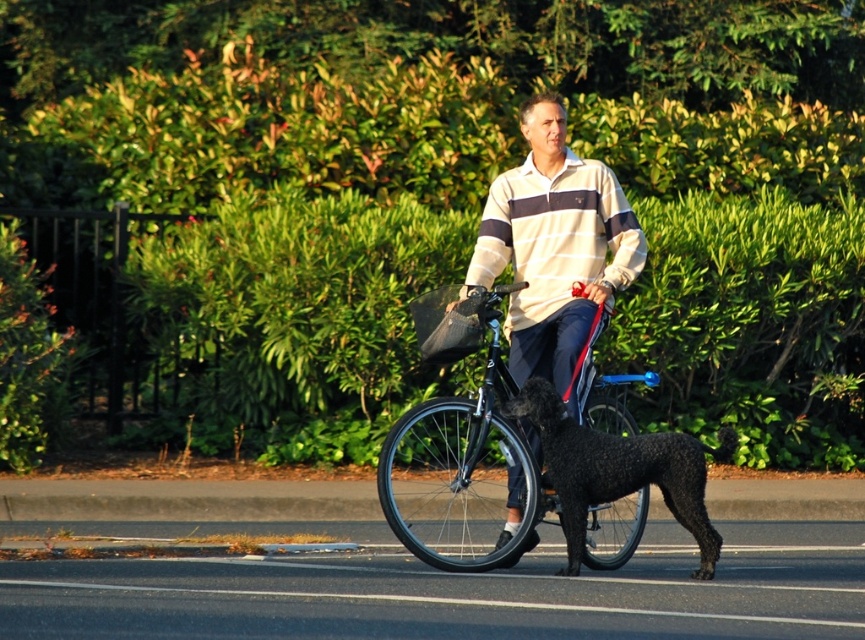
Is point (580, 340) positioned behind point (658, 483)?

Yes, it is.

Between point (578, 392) and point (692, 502), which one is positioned in front?

Point (692, 502) is in front.

Locate an element on the screen. The image size is (865, 640). striped cotton shirt at center is located at coordinates (556, 252).

Between shiny black bicycle at center and black fuzzy dog at center, which one has less height?

Standing shorter between the two is black fuzzy dog at center.

Who is positioned more to the right, shiny black bicycle at center or black fuzzy dog at center?

From the viewer's perspective, black fuzzy dog at center appears more on the right side.

The height and width of the screenshot is (640, 865). I want to click on shiny black bicycle at center, so click(457, 444).

Where is `shiny black bicycle at center`? shiny black bicycle at center is located at coordinates (457, 444).

Does shiny black bicycle at center appear on the left side of striped cotton shirt at center?

Indeed, shiny black bicycle at center is positioned on the left side of striped cotton shirt at center.

Is shiny black bicycle at center above striped cotton shirt at center?

No, shiny black bicycle at center is not above striped cotton shirt at center.

What do you see at coordinates (457, 444) in the screenshot? I see `shiny black bicycle at center` at bounding box center [457, 444].

Image resolution: width=865 pixels, height=640 pixels. Find the location of `shiny black bicycle at center`. shiny black bicycle at center is located at coordinates (457, 444).